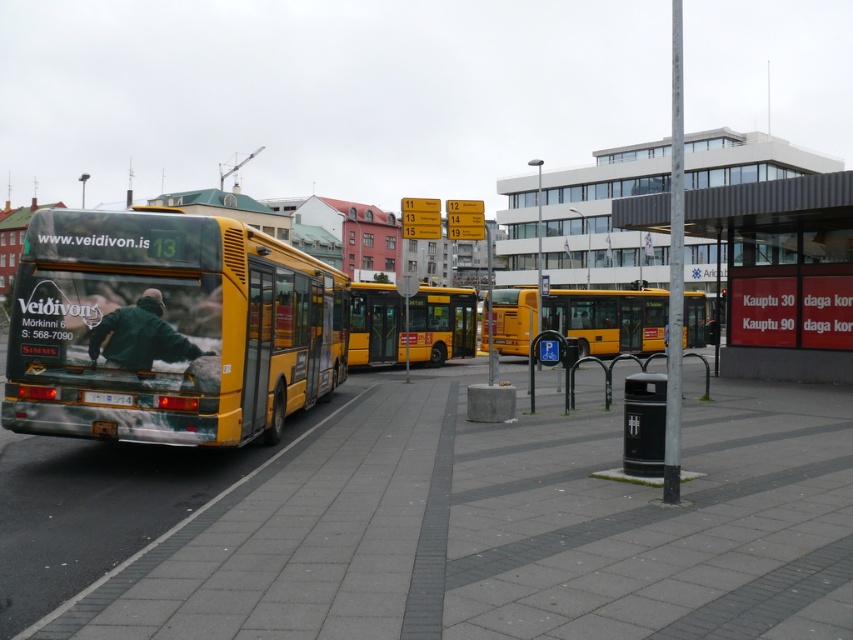
Question: Which point is closer to the camera taking this photo?

Choices:
 (A) 839,248
 (B) 786,602
 (C) 602,339

Answer: (B)

Question: Where is gray concrete pavement at center located in relation to yellow metallic bus stop at center in the image?

Choices:
 (A) above
 (B) below

Answer: (B)

Question: Is gray concrete pavement at center to the left of yellow metallic bus stop at center from the viewer's perspective?

Choices:
 (A) yes
 (B) no

Answer: (A)

Question: Which is farther from the yellow matte bus at center?

Choices:
 (A) gray concrete pavement at center
 (B) yellow matte bus at left
 (C) yellow metallic bus at center
 (D) yellow metallic bus stop at center

Answer: (A)

Question: Is yellow metallic bus stop at center smaller than yellow matte bus at center?

Choices:
 (A) yes
 (B) no

Answer: (B)

Question: Which point is closer to the camera?

Choices:
 (A) (445, 404)
 (B) (784, 376)
 (C) (457, 339)

Answer: (A)